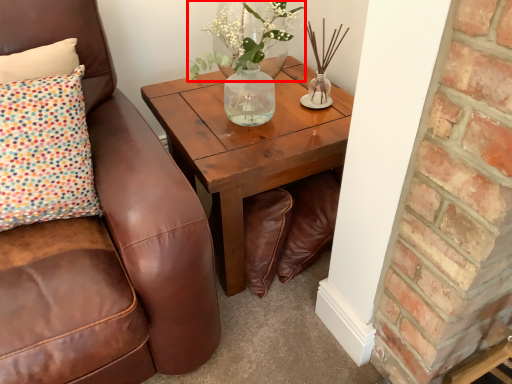
Question: Considering the relative positions of floral arrangement (annotated by the red box) and coffee table in the image provided, where is floral arrangement (annotated by the red box) located with respect to the staircase?

Choices:
 (A) left
 (B) right

Answer: (A)